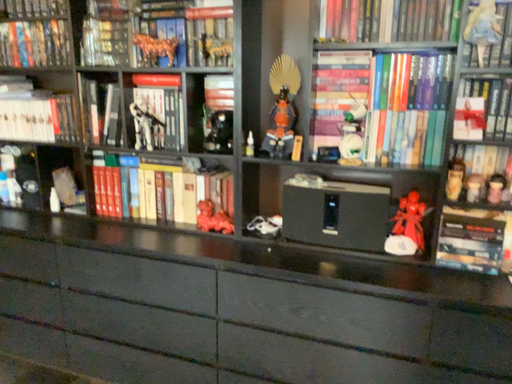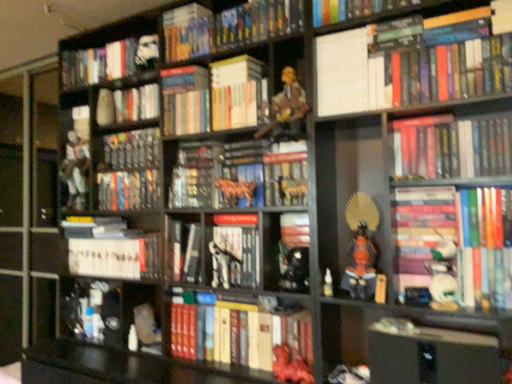
Question: Which way did the camera rotate in the video?

Choices:
 (A) rotated upward
 (B) rotated downward

Answer: (A)